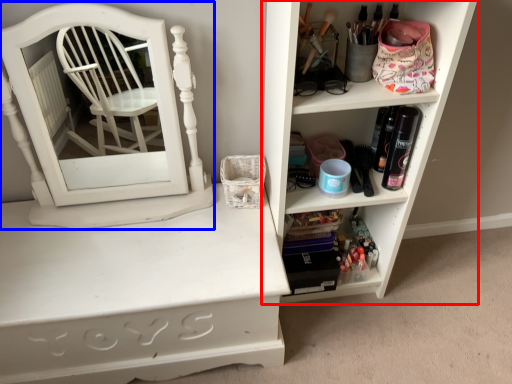
Question: Which object appears closest to the camera in this image, shelf (highlighted by a red box) or medicine cabinet (highlighted by a blue box)?

Choices:
 (A) shelf
 (B) medicine cabinet

Answer: (A)